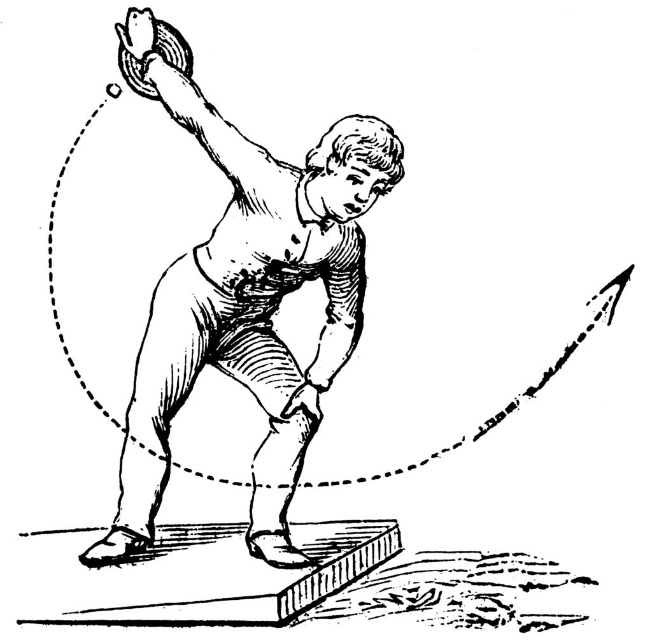
Question: Which of the following is the farthest from the observer?

Choices:
 (A) (91, 276)
 (B) (314, 228)

Answer: (A)

Question: Can you confirm if black line at upper center is positioned to the left of smooth paper man at center?

Choices:
 (A) yes
 (B) no

Answer: (B)

Question: Does black line at upper center have a smaller size compared to smooth paper man at center?

Choices:
 (A) no
 (B) yes

Answer: (B)

Question: Which of the following is the closest to the observer?

Choices:
 (A) black line at upper center
 (B) smooth paper man at center

Answer: (B)

Question: Considering the relative positions of black line at upper center and smooth paper man at center in the image provided, where is black line at upper center located with respect to smooth paper man at center?

Choices:
 (A) right
 (B) left

Answer: (A)

Question: Which object appears farthest from the camera in this image?

Choices:
 (A) black line at upper center
 (B) smooth paper man at center

Answer: (A)